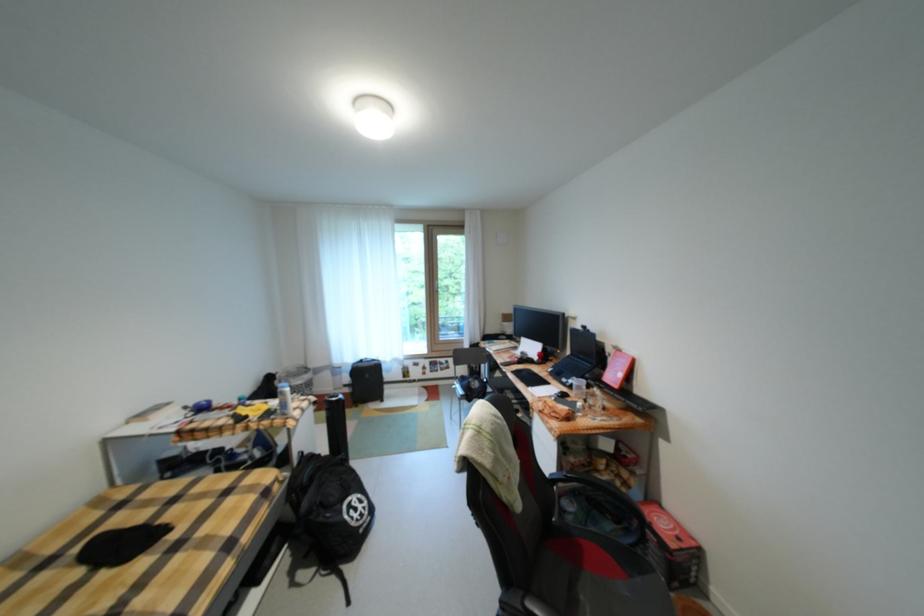
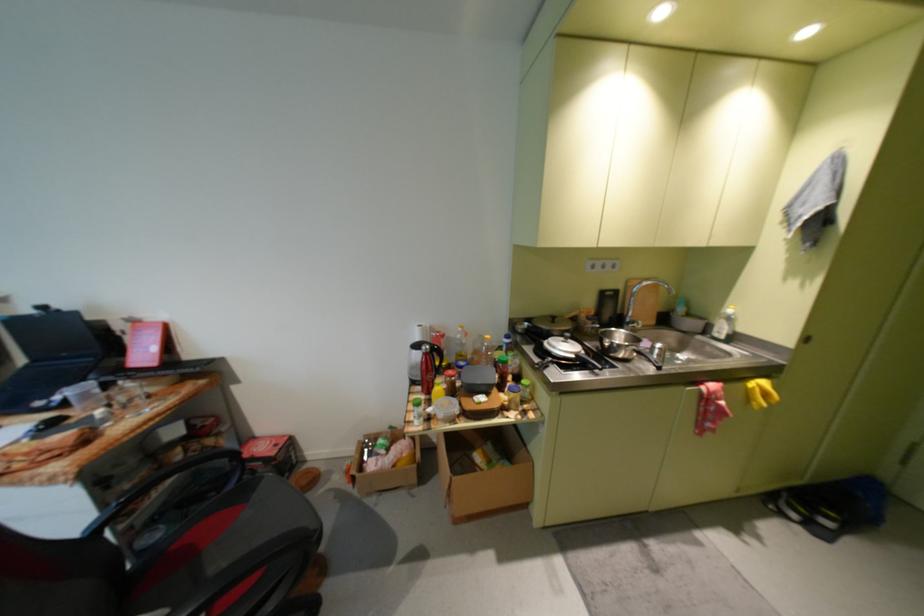
First-person continuous shooting, in which direction is the camera rotating?

The camera rotated toward right-down.